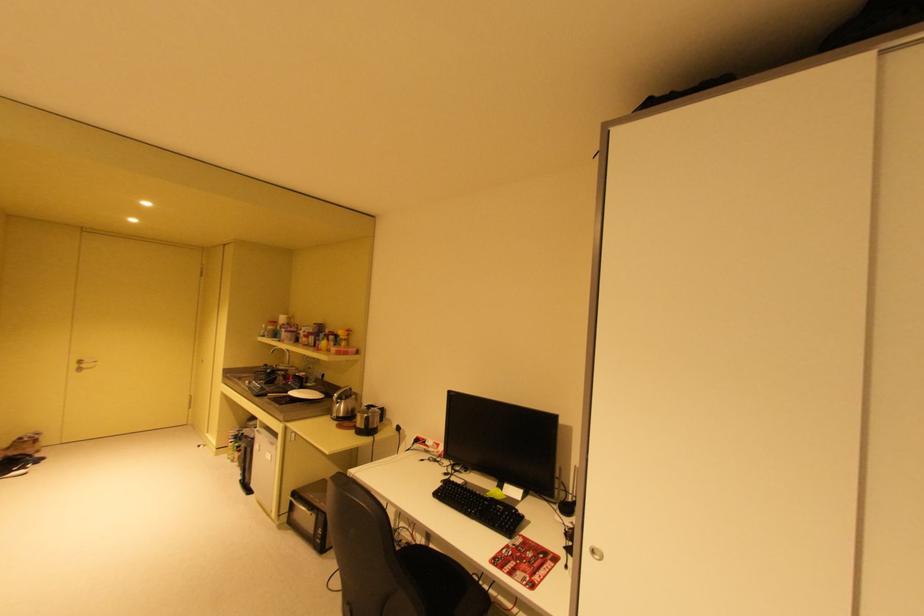
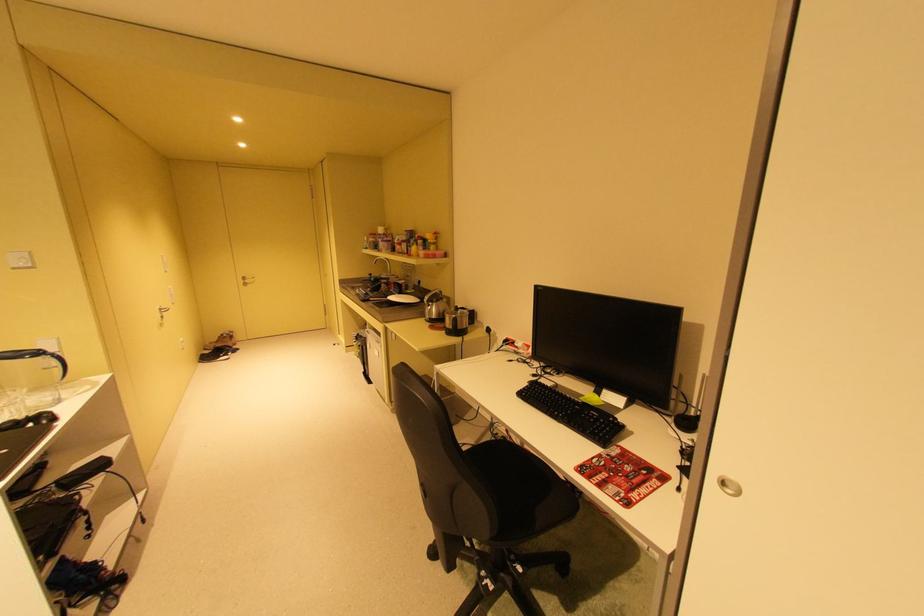
The point at (89, 362) is marked in the first image. Where is the corresponding point in the second image?

(252, 278)